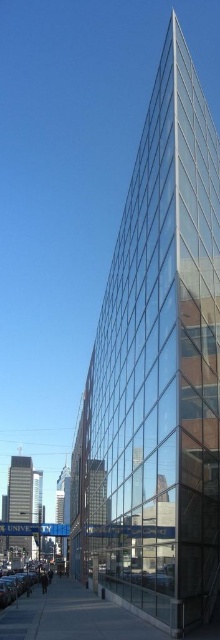
You are standing on the sidewalk in front of the modern building. You notice two points marked on the glass facade. The first point is at coordinates point (104, 612) and the second is at point (23, 588). Which point appears closer to you?

Point (104, 612) is closer to the viewer than point (23, 588).

You are a delivery person needing to park your shiny silver car at lower left near the concrete sidewalk at lower center. Is there enough space to park the car next to the sidewalk?

The concrete sidewalk at lower center might be wider than shiny silver car at lower left, so there is likely enough space to park the car next to the sidewalk.

You are a delivery person trying to park your shiny silver car at lower left near the concrete sidewalk at lower center. However, you need to ensure there is enough space. Based on the scene, can you park your car there without overlapping the sidewalk?

The concrete sidewalk at lower center occupies less space than the shiny silver car at lower left. This means the car is larger in size compared to the sidewalk. Since the sidewalk is smaller, there might not be enough space to park the car there without overlapping the sidewalk.